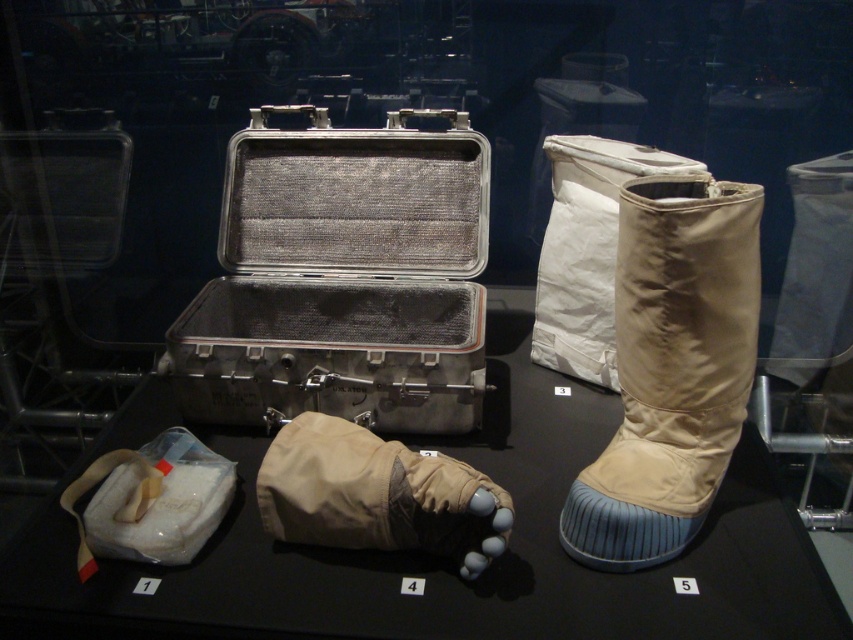
Based on the photo, you are a museum curator who needs to place a new item on the display. The new item is taller than the white fabric bag at lower left but shorter than the beige fabric boot at upper right. Where should you place the new item to ensure it fits appropriately in the display?

The beige fabric boot at upper right is taller than the white fabric bag at lower left. Since the new item is taller than the white fabric bag at lower left but shorter than the beige fabric boot at upper right, it can be placed anywhere between their heights in the display.

You are a museum curator arranging items on a display table. You have a beige fabric glove at center and a white fabric bag at lower left. Which object should you place closer to the edge of the table to ensure both fit within the display area?

The white fabric bag at lower left should be placed closer to the edge of the table since it is smaller in size than the beige fabric glove at center, allowing both to fit within the display area.